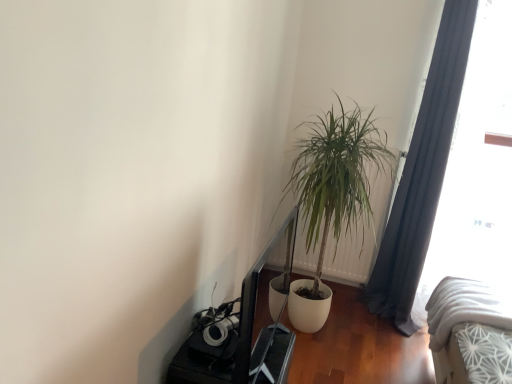
Question: From the image's perspective, is white plastic radiator at center-right located above transparent glass window at right?

Choices:
 (A) no
 (B) yes

Answer: (A)

Question: Does white plastic radiator at center-right come behind transparent glass window at right?

Choices:
 (A) no
 (B) yes

Answer: (B)

Question: Is white plastic radiator at center-right positioned beyond the bounds of transparent glass window at right?

Choices:
 (A) yes
 (B) no

Answer: (A)

Question: From a real-world perspective, is white plastic radiator at center-right physically below transparent glass window at right?

Choices:
 (A) yes
 (B) no

Answer: (A)

Question: Could you tell me if white plastic radiator at center-right is turned towards transparent glass window at right?

Choices:
 (A) yes
 (B) no

Answer: (B)

Question: In terms of width, does dark gray fabric curtain at right look wider or thinner when compared to white plastic radiator at center-right?

Choices:
 (A) wide
 (B) thin

Answer: (A)

Question: From the image's perspective, is dark gray fabric curtain at right above or below white plastic radiator at center-right?

Choices:
 (A) above
 (B) below

Answer: (A)

Question: Considering their positions, is dark gray fabric curtain at right located in front of or behind white plastic radiator at center-right?

Choices:
 (A) behind
 (B) front

Answer: (B)

Question: Is point (394, 281) closer or farther from the camera than point (381, 223)?

Choices:
 (A) closer
 (B) farther

Answer: (B)

Question: From the image's perspective, is transparent glass window at right positioned above or below green leafy plant at center?

Choices:
 (A) below
 (B) above

Answer: (B)

Question: Do you think transparent glass window at right is within green leafy plant at center, or outside of it?

Choices:
 (A) inside
 (B) outside

Answer: (B)

Question: Is point (507, 11) closer or farther from the camera than point (373, 142)?

Choices:
 (A) farther
 (B) closer

Answer: (B)

Question: Based on their sizes in the image, would you say transparent glass window at right is bigger or smaller than green leafy plant at center?

Choices:
 (A) small
 (B) big

Answer: (A)

Question: From the image's perspective, relative to white plastic radiator at center-right, is transparent glass window at right above or below?

Choices:
 (A) below
 (B) above

Answer: (B)

Question: Is transparent glass window at right in front of or behind white plastic radiator at center-right in the image?

Choices:
 (A) front
 (B) behind

Answer: (A)